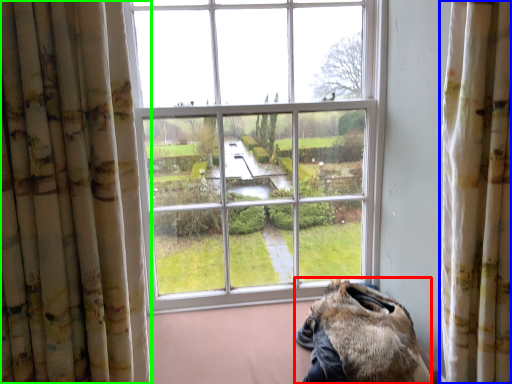
Question: Which object is positioned closest to animal (highlighted by a red box)? Select from curtain (highlighted by a blue box) and curtain (highlighted by a green box).

Choices:
 (A) curtain
 (B) curtain

Answer: (A)